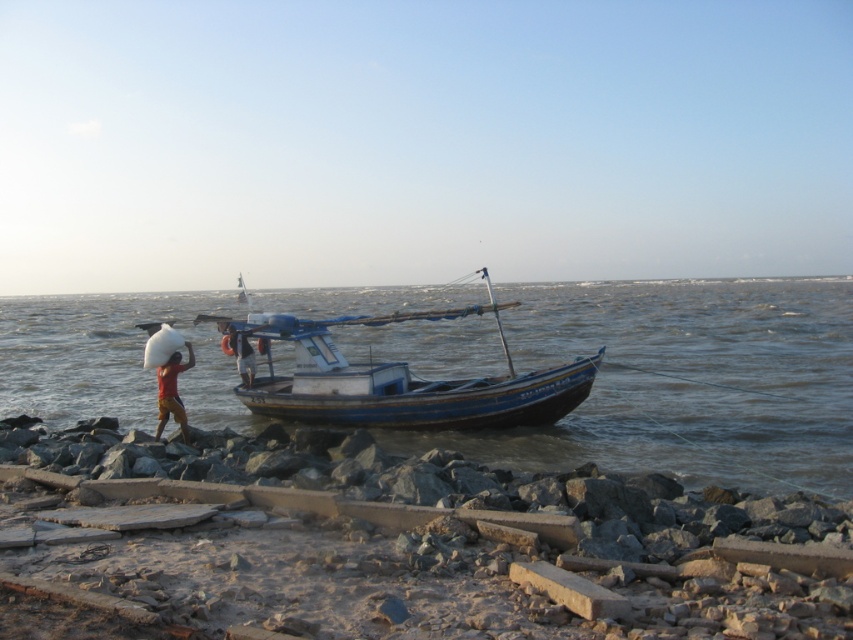
Question: Is blue wooden boat at lower center to the right of red fabric bag at center from the viewer's perspective?

Choices:
 (A) no
 (B) yes

Answer: (B)

Question: Among these points, which one is farthest from the camera?

Choices:
 (A) (68, 419)
 (B) (250, 352)

Answer: (A)

Question: Estimate the real-world distances between objects in this image. Which object is farther from the blue wooden boat at lower center?

Choices:
 (A) blue wooden boat at center
 (B) dark blue fabric shirt at center
 (C) red fabric bag at center

Answer: (C)

Question: Can you confirm if blue wooden boat at lower center is thinner than dark blue fabric shirt at center?

Choices:
 (A) no
 (B) yes

Answer: (A)

Question: Does blue wooden boat at center appear under dark blue fabric shirt at center?

Choices:
 (A) yes
 (B) no

Answer: (B)

Question: Which is farther from the blue wooden boat at center?

Choices:
 (A) red fabric bag at center
 (B) dark blue fabric shirt at center

Answer: (A)